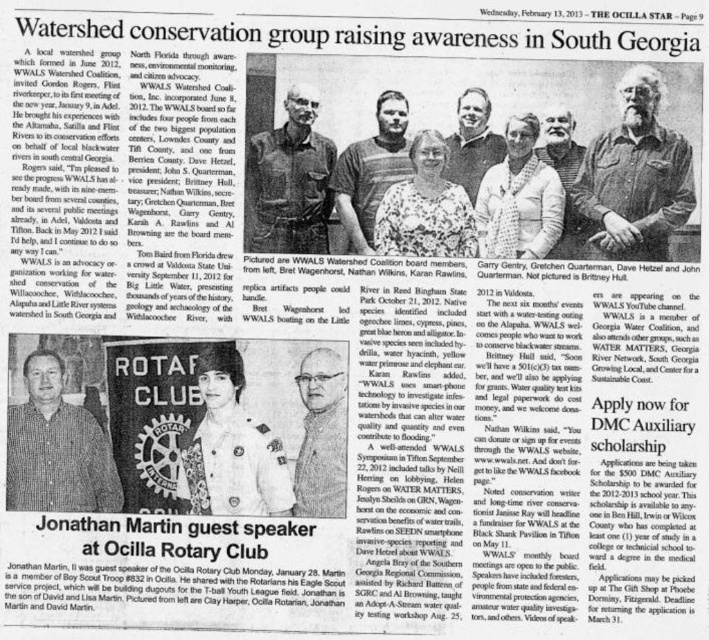
Does grayish-brown leather jacket at upper right appear under dark blue uniform at center?

No, grayish-brown leather jacket at upper right is not below dark blue uniform at center.

Is point (664, 136) farther from viewer compared to point (296, 109)?

Yes, it is.

Find the location of a particular element. grayish-brown leather jacket at upper right is located at coordinates (635, 176).

Is white matte glasses at center above gray hair at center?

Incorrect, white matte glasses at center is not positioned above gray hair at center.

Which is above, white matte glasses at center or gray hair at center?

gray hair at center

This screenshot has width=709, height=640. What are the coordinates of `white matte glasses at center` in the screenshot? It's located at (320, 435).

Does white uniform shirt at center have a greater height compared to dark blue uniform at center?

Yes.

Is point (216, 368) farther from camera compared to point (273, 195)?

That is False.

Locate an element on the screen. white uniform shirt at center is located at coordinates (230, 448).